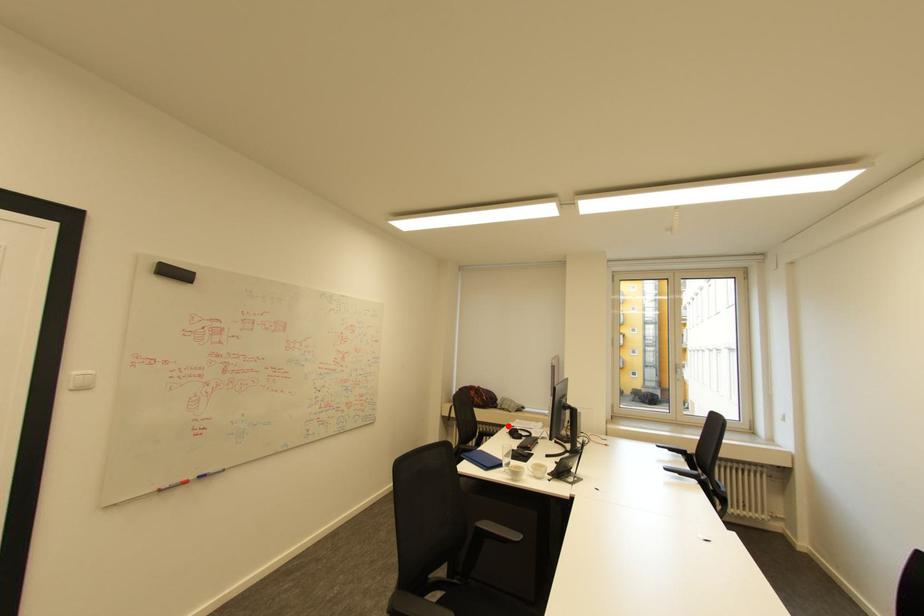
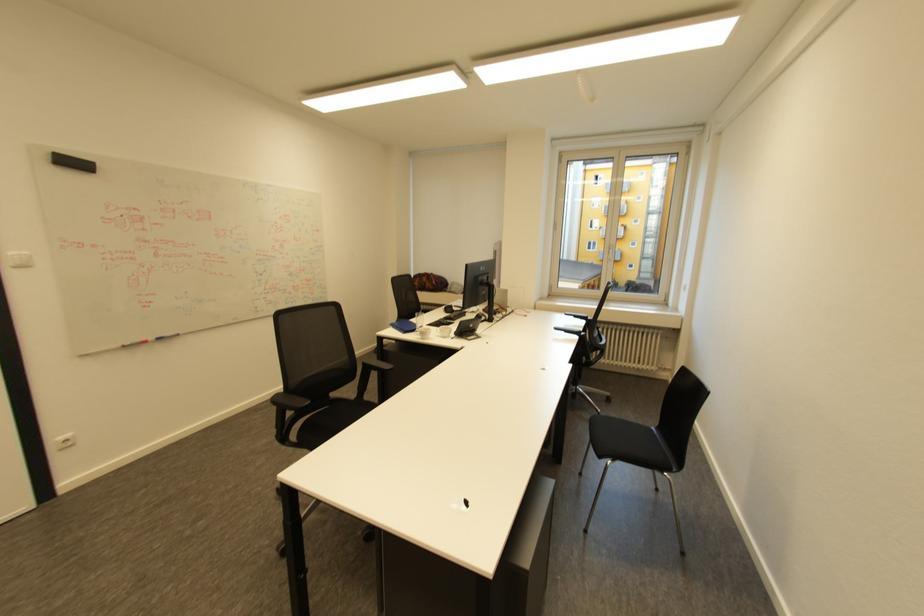
Where in the second image is the point corresponding to the highlighted location from the first image?

(448, 305)